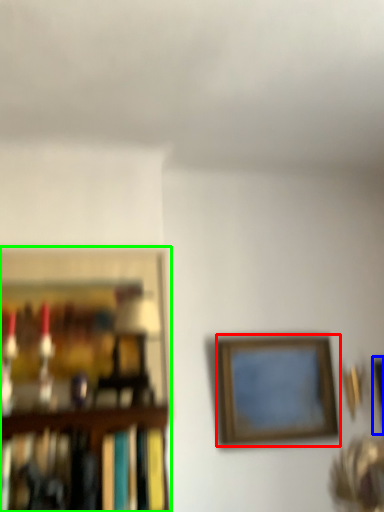
Question: Based on their relative distances, which object is farther from picture frame (highlighted by a red box)? Choose from picture frame (highlighted by a blue box) and picture frame (highlighted by a green box).

Choices:
 (A) picture frame
 (B) picture frame

Answer: (B)